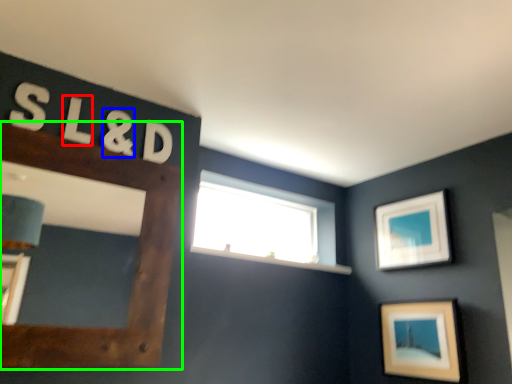
Question: Considering the real-world distances, which object is farthest from letter (highlighted by a red box)? number (highlighted by a blue box) or picture frame (highlighted by a green box)?

Choices:
 (A) number
 (B) picture frame

Answer: (B)